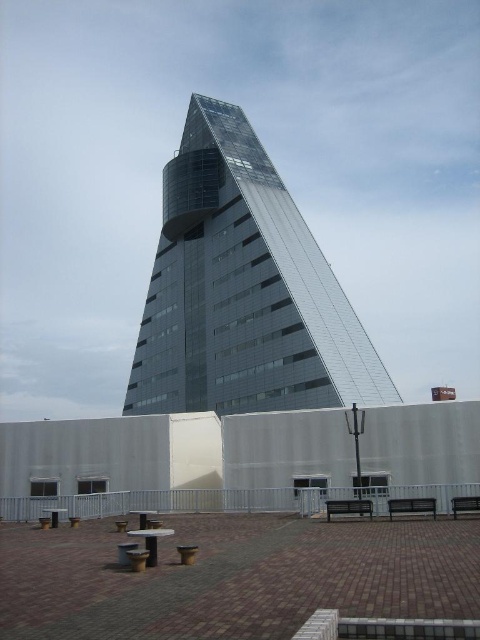
Question: Which point appears closest to the camera in this image?

Choices:
 (A) (228, 280)
 (B) (463, 504)

Answer: (B)

Question: Is black metal bench at lower right closer to camera compared to metallic silver bench at lower right?

Choices:
 (A) no
 (B) yes

Answer: (A)

Question: Which object appears farthest from the camera in this image?

Choices:
 (A) black metal bench at lower right
 (B) metallic silver bench at lower right
 (C) wooden park bench at center

Answer: (A)

Question: Can you confirm if black metal bench at lower right is positioned to the right of metallic silver bench at lower right?

Choices:
 (A) no
 (B) yes

Answer: (A)

Question: Which point is farther to the camera?

Choices:
 (A) wooden park bench at center
 (B) black metal bench at lower right
 (C) transparent glass building at center
 (D) metallic silver bench at lower right

Answer: (C)

Question: Can you confirm if wooden park bench at center is smaller than metallic silver bench at lower right?

Choices:
 (A) no
 (B) yes

Answer: (A)